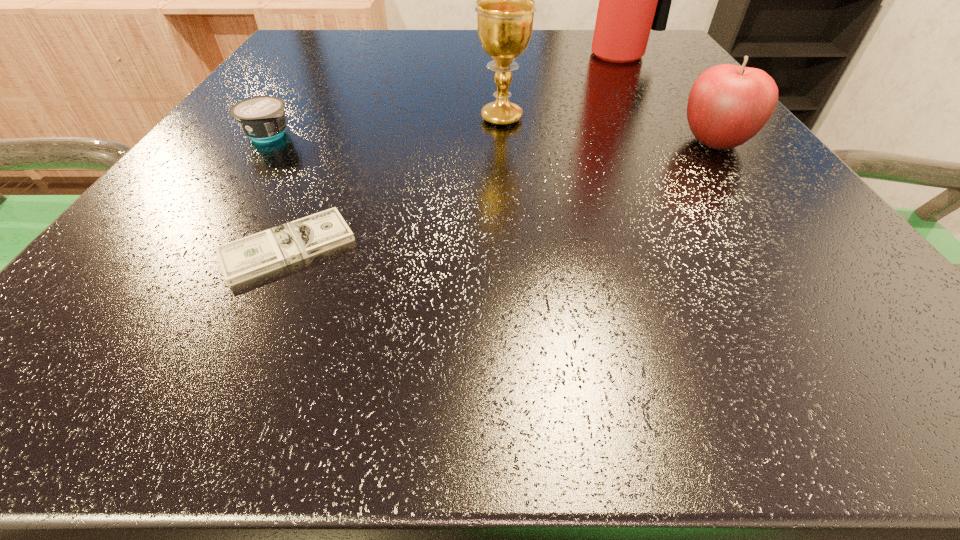
Where is `fire extinguisher`? fire extinguisher is located at coordinates (633, 0).

The height and width of the screenshot is (540, 960). Find the location of `the farthest object`. the farthest object is located at coordinates (633, 0).

At what (x,y) coordinates should I click in order to perform the action: click on the third object from right to left. Please return your answer as a coordinate pair (x, y). Image resolution: width=960 pixels, height=540 pixels. Looking at the image, I should click on (505, 8).

Locate an element on the screen. chalice is located at coordinates (505, 8).

Locate an element on the screen. apple is located at coordinates (728, 105).

Identify the location of the second shortest object. The image size is (960, 540). (262, 118).

Where is `the shortest object`? The height and width of the screenshot is (540, 960). the shortest object is located at coordinates (254, 255).

Image resolution: width=960 pixels, height=540 pixels. I want to click on the nearest object, so click(x=254, y=255).

You are a GUI agent. You are given a task and a screenshot of the screen. Output one action in this format:
    pyautogui.click(x=<x>, y=<y>)
    Task: Click on the free spot located at the nozzle of the tallest object
    Image resolution: width=960 pixels, height=540 pixels.
    Given the screenshot: What is the action you would take?
    pyautogui.click(x=660, y=123)

This screenshot has width=960, height=540. I want to click on vacant area situated 0.080m on the left of the third object from right to left, so (x=426, y=118).